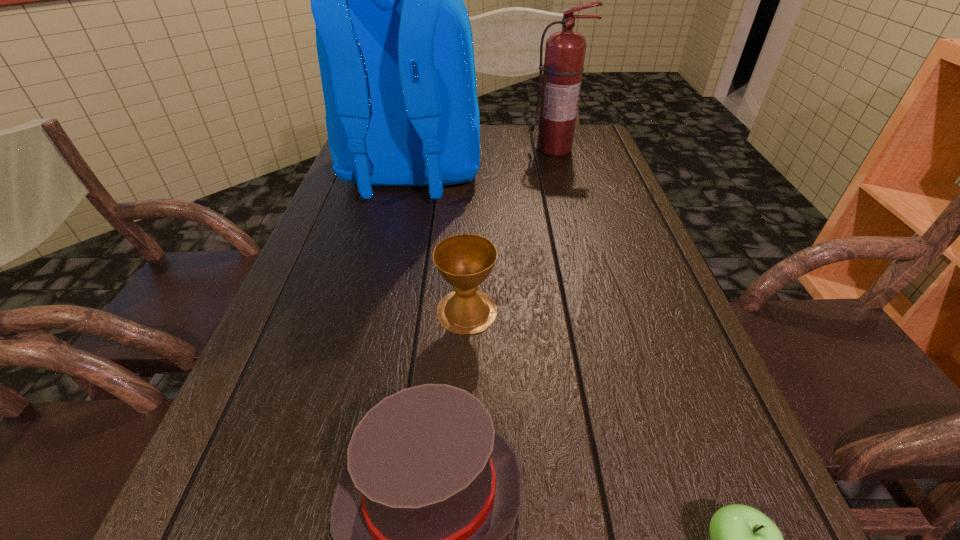
What are the coordinates of `object that is at the far left corner` in the screenshot? It's located at (395, 48).

You are a GUI agent. You are given a task and a screenshot of the screen. Output one action in this format:
    pyautogui.click(x=<x>, y=<y>)
    Task: Click on the object that is at the far right corner
    
    Given the screenshot: What is the action you would take?
    pyautogui.click(x=563, y=67)

The width and height of the screenshot is (960, 540). In order to click on blank space at the far edge of the desktop in this screenshot , I will do `click(490, 158)`.

I want to click on vacant space at the left edge of the desktop, so click(302, 274).

Locate an element on the screen. Image resolution: width=960 pixels, height=540 pixels. free region at the right edge is located at coordinates (635, 225).

Find the location of `free space between the tallest object and the fire extinguisher`. free space between the tallest object and the fire extinguisher is located at coordinates (483, 162).

The image size is (960, 540). What are the coordinates of `free space between the fire extinguisher and the tallest object` in the screenshot? It's located at (483, 162).

Locate which object is the second closest to the fire extinguisher. Please provide its 2D coordinates. Your answer should be formatted as a tuple, i.e. [(x, y)], where the tuple contains the x and y coordinates of a point satisfying the conditions above.

[(465, 261)]

Locate which object ranks fourth in proximity to the fire extinguisher. Please provide its 2D coordinates. Your answer should be formatted as a tuple, i.e. [(x, y)], where the tuple contains the x and y coordinates of a point satisfying the conditions above.

[(743, 539)]